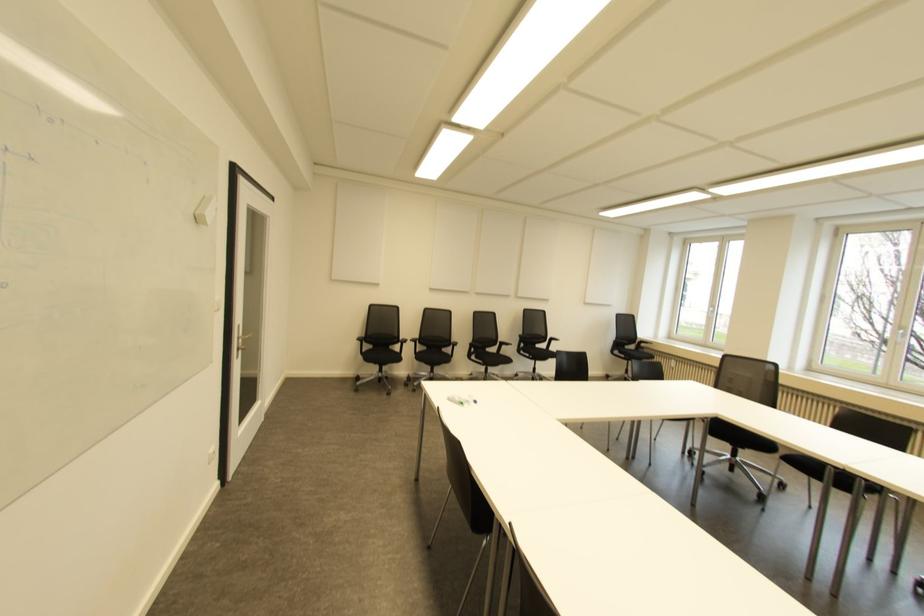
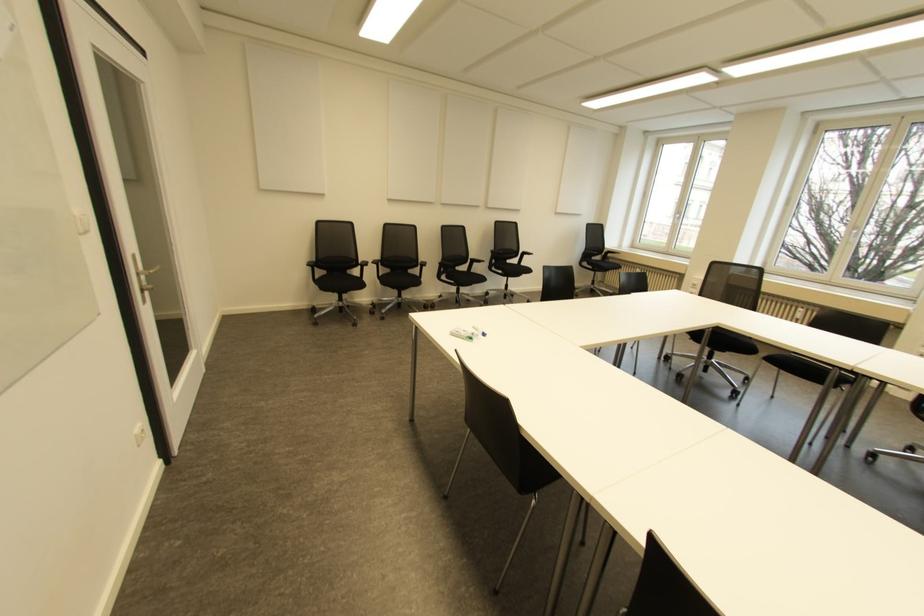
The point at (426, 363) is marked in the first image. Where is the corresponding point in the second image?

(393, 286)